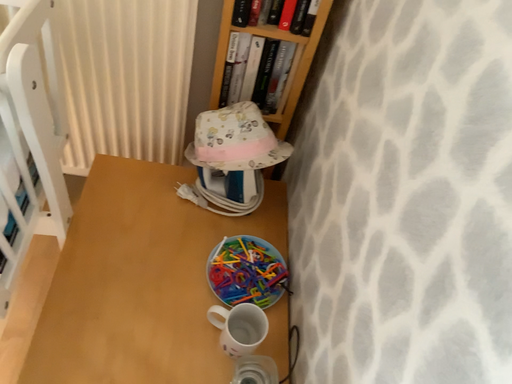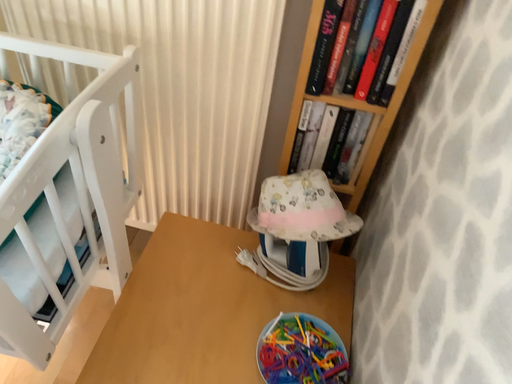
Question: How did the camera likely rotate when shooting the video?

Choices:
 (A) rotated downward
 (B) rotated upward

Answer: (B)